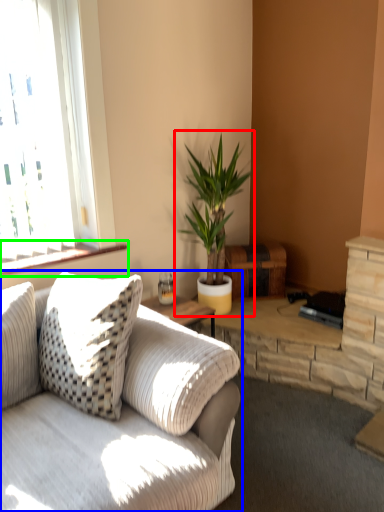
Question: Which is nearer to the houseplant (highlighted by a red box)? studio couch (highlighted by a blue box) or window sill (highlighted by a green box).

Choices:
 (A) studio couch
 (B) window sill

Answer: (B)